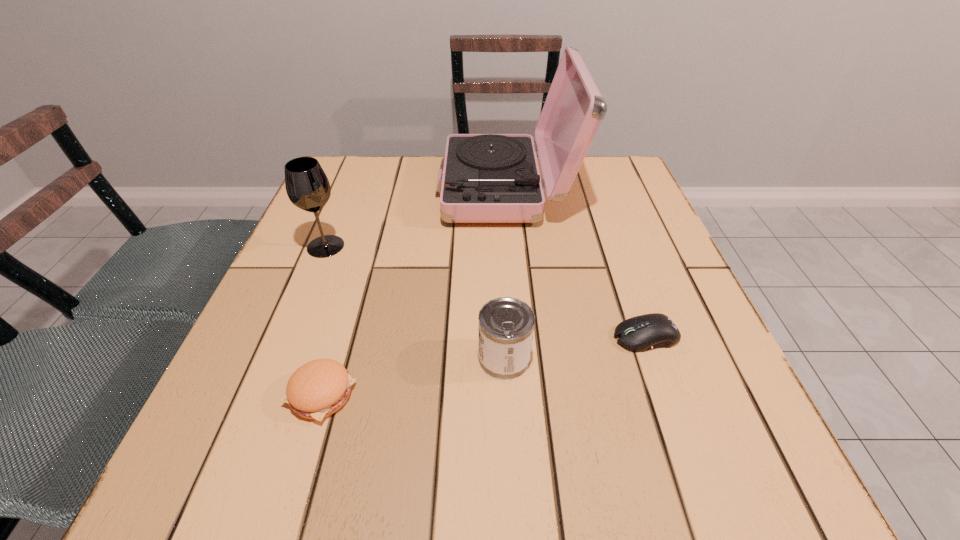
Find the location of `vacant region at the far right corner of the desktop`. vacant region at the far right corner of the desktop is located at coordinates (602, 186).

Where is `empty space between the can and the second farthest object`? The width and height of the screenshot is (960, 540). empty space between the can and the second farthest object is located at coordinates pos(415,302).

At what (x,y) coordinates should I click in order to perform the action: click on vacant area that lies between the patty and the tallest object. Please return your answer as a coordinate pair (x, y). This screenshot has width=960, height=540. Looking at the image, I should click on (413, 292).

You are a GUI agent. You are given a task and a screenshot of the screen. Output one action in this format:
    pyautogui.click(x=<x>, y=<y>)
    Task: Click on the free space between the patty and the farthest object
    
    Given the screenshot: What is the action you would take?
    pyautogui.click(x=413, y=292)

You are a GUI agent. You are given a task and a screenshot of the screen. Output one action in this format:
    pyautogui.click(x=<x>, y=<y>)
    Task: Click on the vacant area that lies between the patty and the third tallest object
    Image resolution: width=960 pixels, height=540 pixels.
    Given the screenshot: What is the action you would take?
    pyautogui.click(x=413, y=376)

Where is `vacant area between the shortest object and the fourth nearest object`? The width and height of the screenshot is (960, 540). vacant area between the shortest object and the fourth nearest object is located at coordinates (486, 291).

You are a GUI agent. You are given a task and a screenshot of the screen. Output one action in this format:
    pyautogui.click(x=<x>, y=<y>)
    Task: Click on the free space between the can and the record player
    This screenshot has width=960, height=540.
    Given the screenshot: What is the action you would take?
    pyautogui.click(x=505, y=273)

This screenshot has width=960, height=540. In order to click on empty space between the tallest object and the third tallest object in this screenshot , I will do `click(505, 273)`.

This screenshot has width=960, height=540. Identify the location of vacant space in between the wineglass and the tallest object. (416, 218).

At what (x,y) coordinates should I click in order to perform the action: click on unoccupied position between the fourth shortest object and the patty. Please return your answer as a coordinate pair (x, y). This screenshot has width=960, height=540. Looking at the image, I should click on (324, 321).